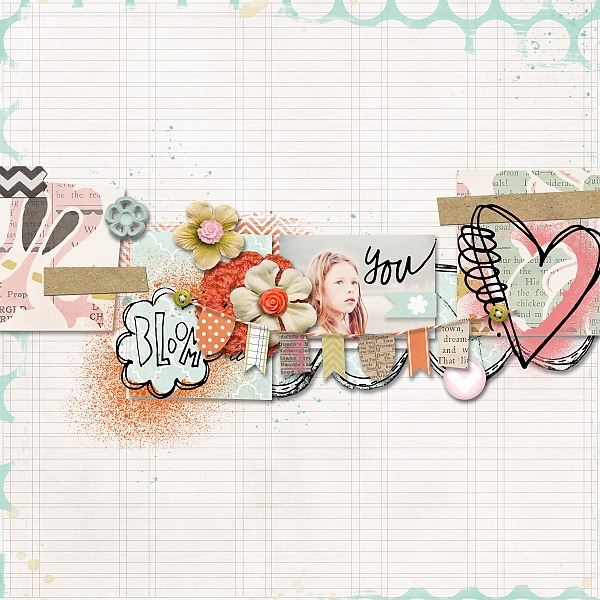
Identify the location of book. (254, 390).